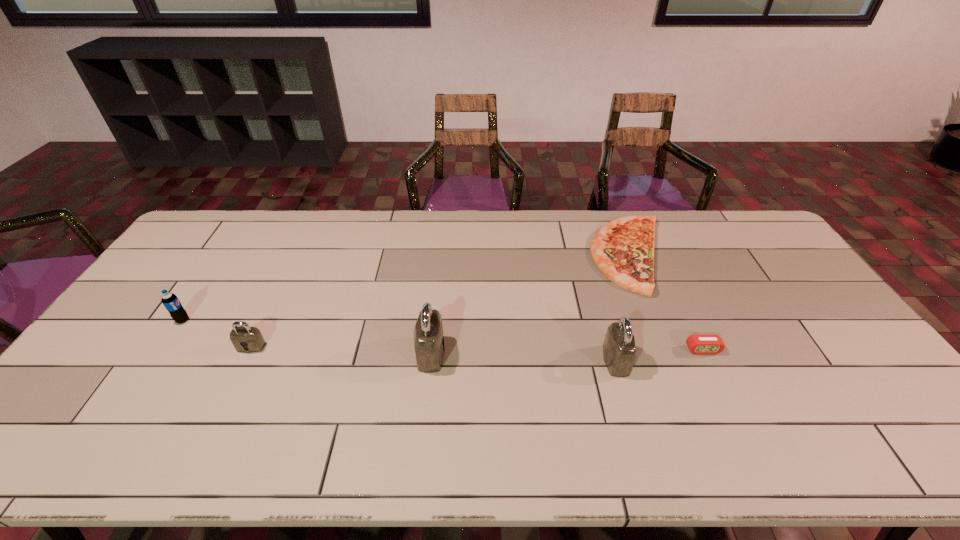
Identify which object is the third nearest to the second padlock from left to right. Please provide its 2D coordinates. Your answer should be formatted as a tuple, i.e. [(x, y)], where the tuple contains the x and y coordinates of a point satisfying the conditions above.

[(623, 249)]

Choose which object is the second nearest neighbor to the fifth shortest object. Please provide its 2D coordinates. Your answer should be formatted as a tuple, i.e. [(x, y)], where the tuple contains the x and y coordinates of a point satisfying the conditions above.

[(623, 249)]

Find the location of `padlock that stands as the second closest to the fourth object from right to left`. padlock that stands as the second closest to the fourth object from right to left is located at coordinates (619, 350).

Identify the location of padlock that can be found as the third closest to the leftmost object. (619, 350).

Locate an element on the screen. vacant space that satisfies the following two spatial constraints: 1. on the front side of the pizza; 2. at the front of the fourth object from right to left near the keyhole is located at coordinates (670, 353).

Image resolution: width=960 pixels, height=540 pixels. I want to click on free region that satisfies the following two spatial constraints: 1. on the front-facing side of the alarm clock; 2. at the front of the second shortest padlock near the keyhole, so 708,360.

This screenshot has height=540, width=960. Identify the location of free location that satisfies the following two spatial constraints: 1. on the front-facing side of the alarm clock; 2. at the front of the second tallest padlock near the keyhole. (708, 360).

Locate an element on the screen. Image resolution: width=960 pixels, height=540 pixels. free space that satisfies the following two spatial constraints: 1. on the front-facing side of the alarm clock; 2. at the front of the second tallest padlock near the keyhole is located at coordinates (708, 360).

You are a GUI agent. You are given a task and a screenshot of the screen. Output one action in this format:
    pyautogui.click(x=<x>, y=<y>)
    Task: Click on the free space that satisfies the following two spatial constraints: 1. on the front-facing side of the alarm clock; 2. at the front of the second tallest padlock near the keyhole
    The image size is (960, 540).
    Given the screenshot: What is the action you would take?
    click(x=708, y=360)